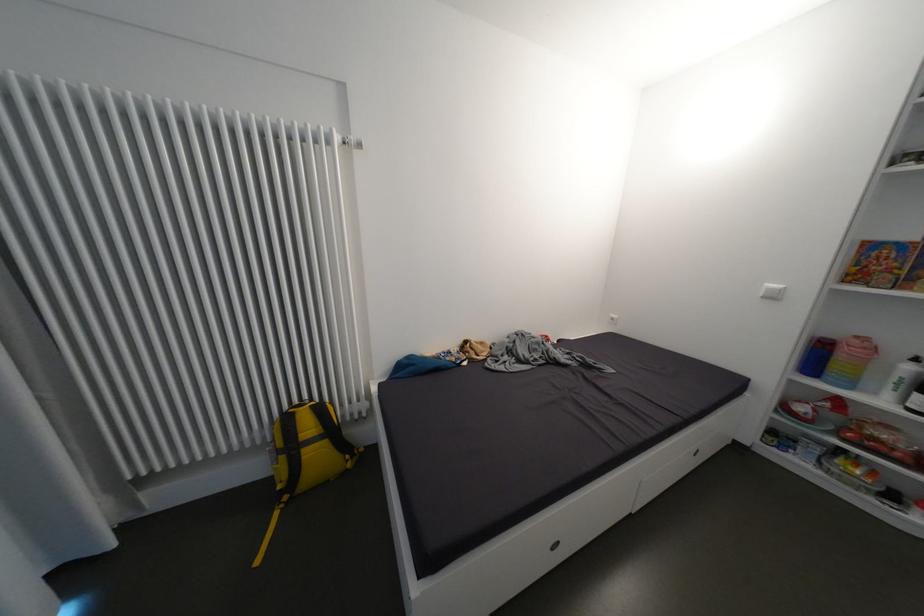
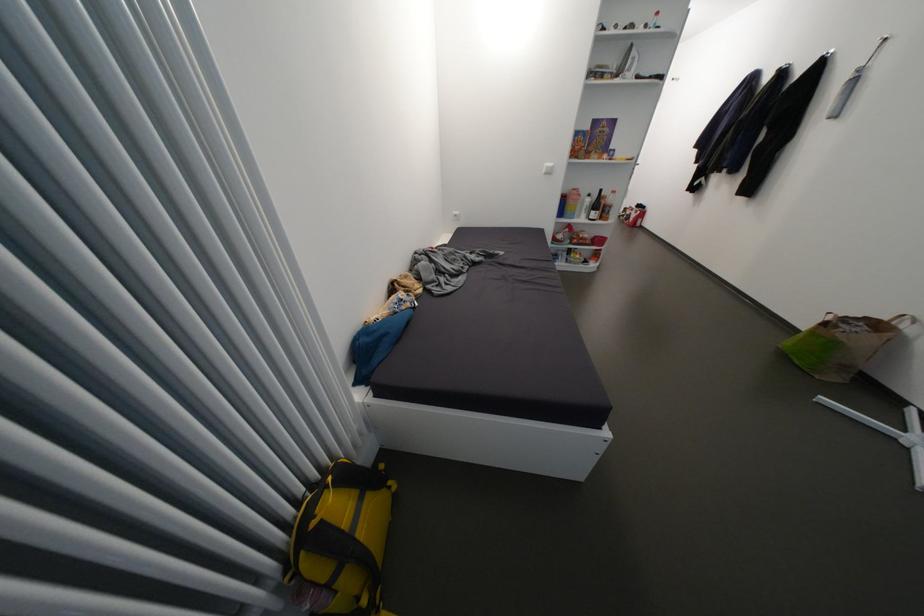
Find the pixel in the second image that matches point 871,350 in the first image.

(585, 196)